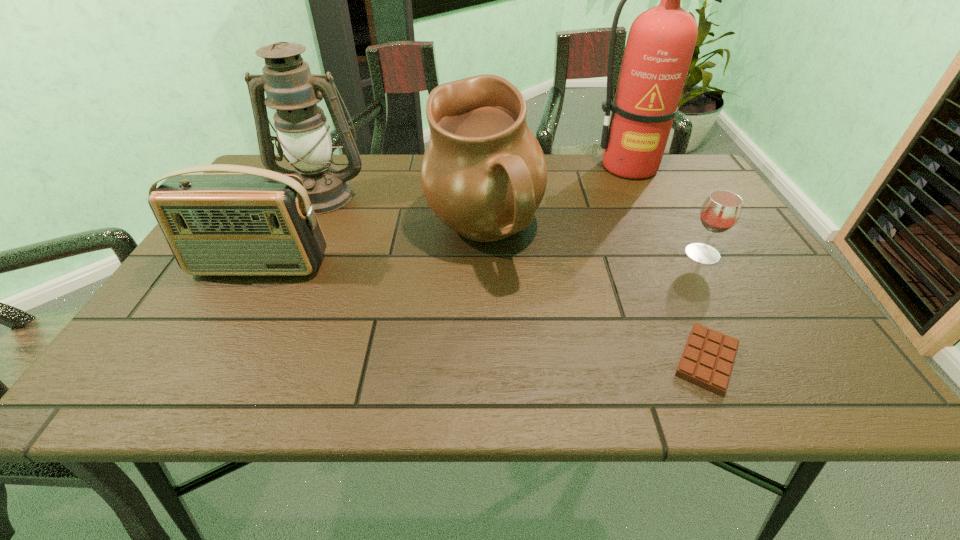
Image resolution: width=960 pixels, height=540 pixels. I want to click on vacant space situated at the spout of the fourth shortest object, so click(x=331, y=234).

Find the location of a particular element. Image resolution: width=960 pixels, height=540 pixels. free spot located at the spout of the fourth shortest object is located at coordinates (320, 234).

Where is `free space located 0.300m at the spout of the fourth shortest object`? This screenshot has height=540, width=960. free space located 0.300m at the spout of the fourth shortest object is located at coordinates (303, 234).

Find the location of a particular element. free location located on the front-facing side of the radio receiver is located at coordinates (216, 346).

At what (x,y) coordinates should I click in order to perform the action: click on vacant space located on the back of the wineglass. Please return your answer as a coordinate pair (x, y). The width and height of the screenshot is (960, 540). Looking at the image, I should click on (657, 173).

You are a GUI agent. You are given a task and a screenshot of the screen. Output one action in this format:
    pyautogui.click(x=<x>, y=<y>)
    Task: Click on the vacant region located 0.230m on the back of the nearest object
    This screenshot has height=540, width=960.
    Given the screenshot: What is the action you would take?
    pyautogui.click(x=658, y=253)

Where is `fire extinguisher that is positioned at the far edge`? The image size is (960, 540). fire extinguisher that is positioned at the far edge is located at coordinates (661, 41).

Locate an element on the screen. The image size is (960, 540). oil lamp situated at the far edge is located at coordinates (303, 135).

At what (x,y) coordinates should I click in order to perform the action: click on cream pitcher that is positioned at the far edge. Please return your answer as a coordinate pair (x, y). Looking at the image, I should click on (484, 174).

Identify the location of object present at the near edge. The height and width of the screenshot is (540, 960). (707, 360).